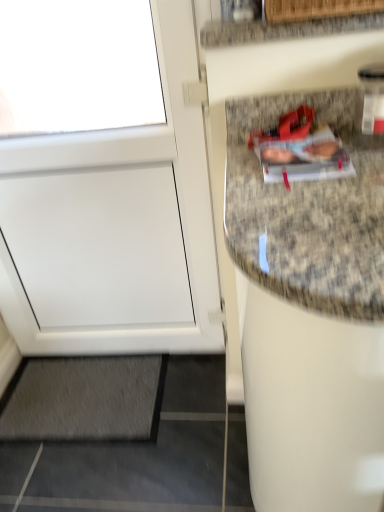
Question: From a real-world perspective, relative to white matte door at left, is gray carpet at lower left vertically above or below?

Choices:
 (A) below
 (B) above

Answer: (A)

Question: Is point (152, 381) positioned closer to the camera than point (102, 263)?

Choices:
 (A) closer
 (B) farther

Answer: (B)

Question: Which of these objects is positioned closest to the white matte door at left?

Choices:
 (A) granite countertop at upper right
 (B) gray carpet at lower left

Answer: (B)

Question: Which is farther from the gray carpet at lower left?

Choices:
 (A) granite countertop at upper right
 (B) white matte door at left

Answer: (A)